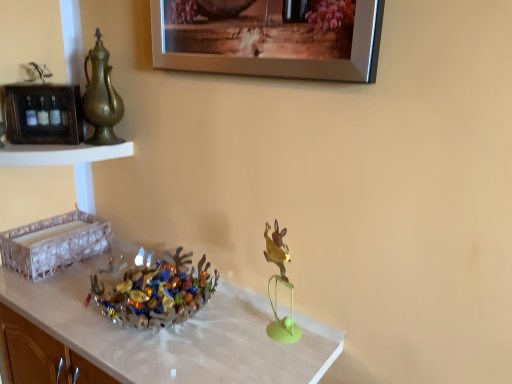
This screenshot has width=512, height=384. I want to click on free space in front of metallic gold rabbit at center, so click(274, 360).